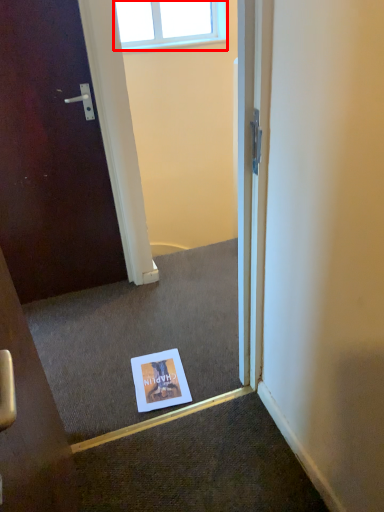
Question: In this image, where is window (annotated by the red box) located relative to flyer?

Choices:
 (A) left
 (B) right

Answer: (A)